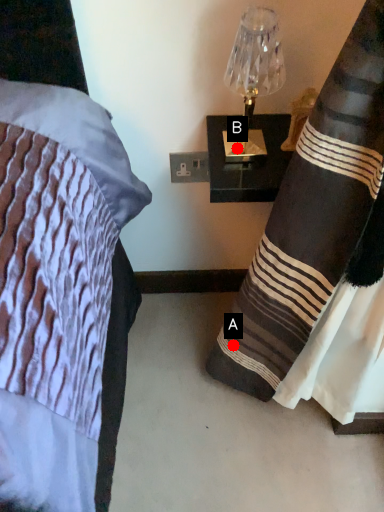
Question: Two points are circled on the image, labeled by A and B beside each circle. Which point is closer to the camera?

Choices:
 (A) A is closer
 (B) B is closer

Answer: (B)